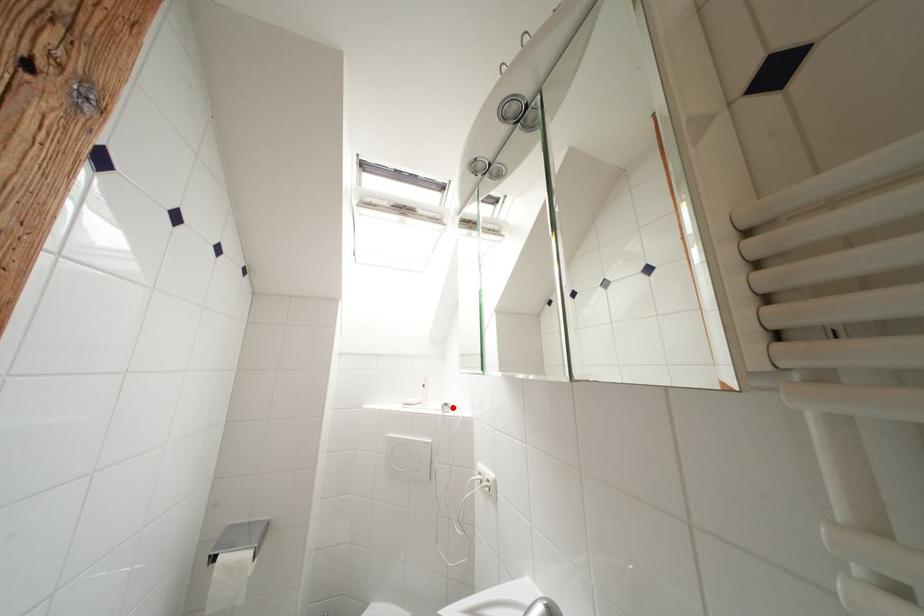
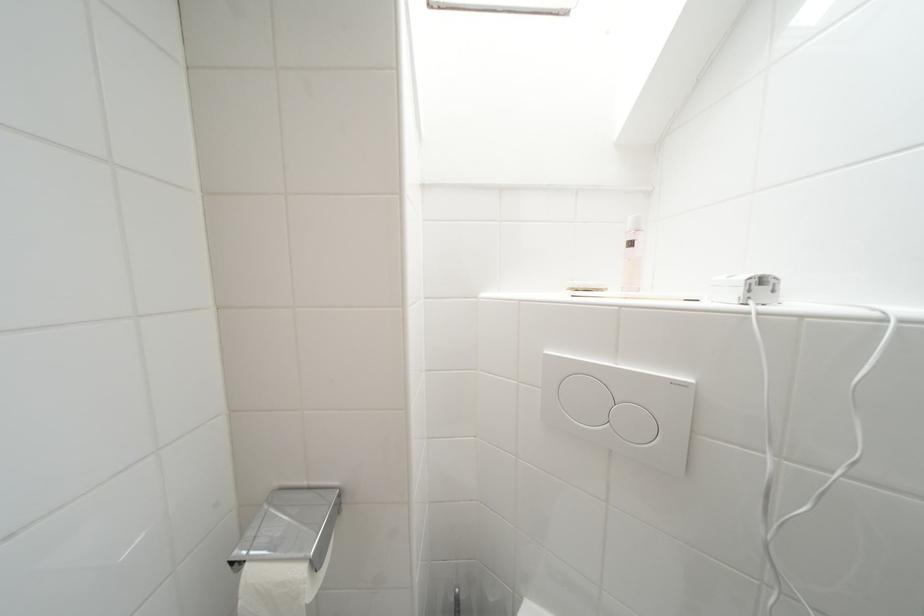
Question: I am providing you with two images of the same scene from different viewpoints. A red point is shown in image1. For the corresponding object point in image2, is it positioned nearer or farther from the camera?

Choices:
 (A) Nearer
 (B) Farther

Answer: (A)